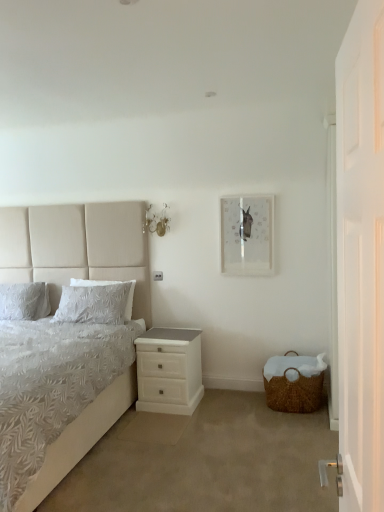
At what (x,y) coordinates should I click in order to perform the action: click on free spot in front of white glossy nightstand at lower center. Please return your answer as a coordinate pair (x, y). The image size is (384, 512). Looking at the image, I should click on [x=165, y=422].